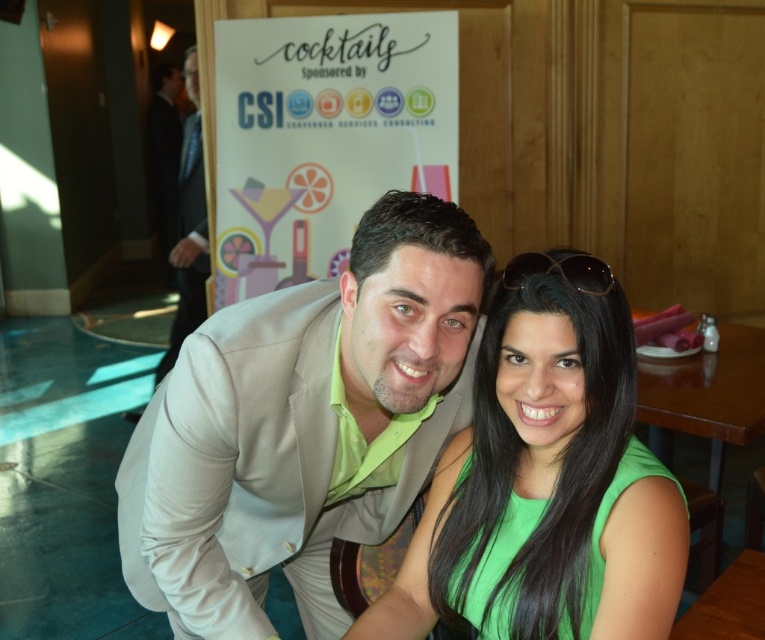
You are a photographer at the event and want to focus on the light beige suit at center and the black suit at left. Which one is nearer to you?

The light beige suit at center is closer to the viewer than the black suit at left, so the light beige suit at center is nearer to you.

Looking at this image, you are at a social event and want to take a photo of the light beige suit at center and sunglasses at upper center. To ensure both are in frame, should you adjust your camera to focus on the left or right side?

The light beige suit at center is positioned on the left side of sunglasses at upper center, so to include both in the frame, focus on the left side where the light beige suit at center is located.

You are standing at the point labeled as point [562,252] and want to walk to the point labeled as point [191,90]. According to the scene description, will you have to walk towards the foreground or the background?

Since point [191,90] is behind point [562,252], you will need to walk towards the background to reach it.